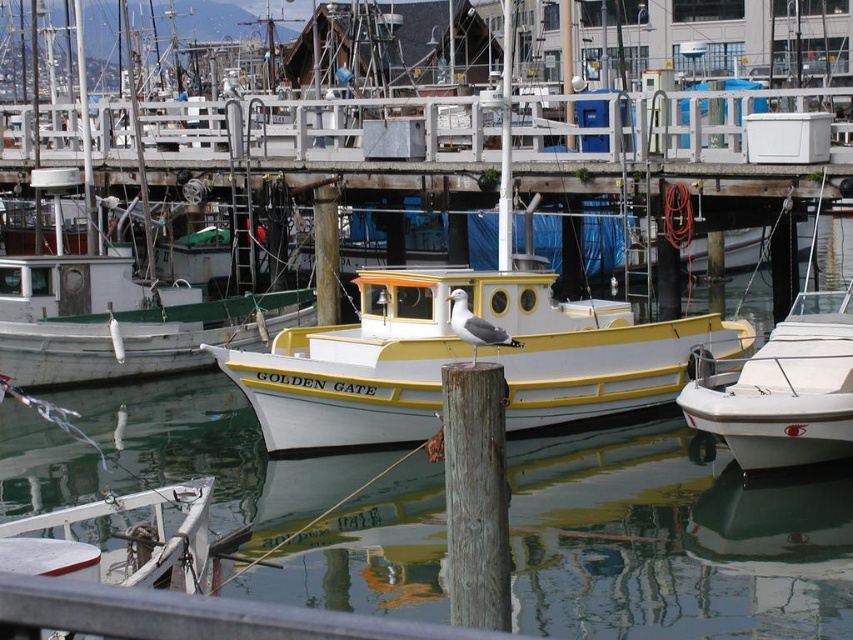
You are a photographer trying to capture both the white matte boat at center and the white matte boat at right in a single shot. Based on their heights, which boat will appear larger in the photo?

The white matte boat at center will appear larger in the photo because it is much taller than the white matte boat at right.

You are standing on the dock and see two white matte boats in the water. Which boat, the white matte boat at center or the white matte boat at right, is closer to you?

The white matte boat at center is closer to you because it is positioned further to the viewer compared to the white matte boat at right.